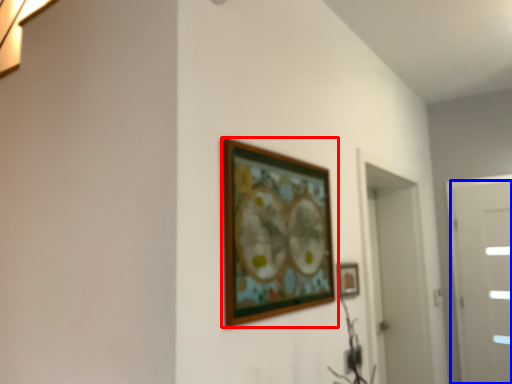
Question: Among these objects, which one is nearest to the camera, picture frame (highlighted by a red box) or door (highlighted by a blue box)?

Choices:
 (A) picture frame
 (B) door

Answer: (A)